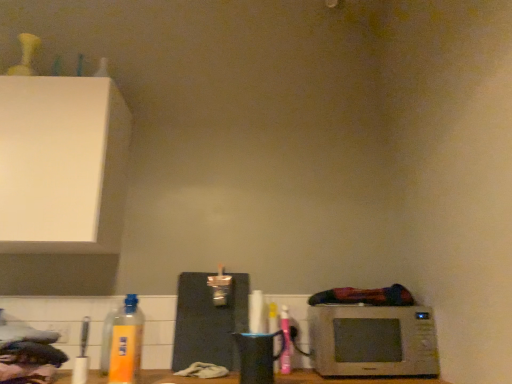
Image resolution: width=512 pixels, height=384 pixels. In order to click on yellow matte bottle at lower left, placed as the 2th bottle when sorted from back to front in this screenshot , I will do `click(108, 338)`.

Measure the distance between point (177, 341) and camera.

Point (177, 341) and camera are 5.88 feet apart from each other.

Image resolution: width=512 pixels, height=384 pixels. What are the coordinates of `yellow matte bottle at lower left, placed as the 2th bottle when sorted from right to left` in the screenshot? It's located at click(126, 343).

At what (x,y) coordinates should I click in order to perform the action: click on silver metallic microwave at lower right. Please return your answer as a coordinate pair (x, y). Looking at the image, I should click on (373, 341).

From the image's perspective, which one is positioned higher, yellow matte bottle at lower left, which appears as the 3th bottle when viewed from the right, or silver metallic microwave at lower right?

yellow matte bottle at lower left, which appears as the 3th bottle when viewed from the right, appears higher in the image.

Looking at this image, does yellow matte bottle at lower left, which appears as the 3th bottle when viewed from the right, have a lesser height compared to silver metallic microwave at lower right?

In fact, yellow matte bottle at lower left, which appears as the 3th bottle when viewed from the right, may be taller than silver metallic microwave at lower right.

In terms of width, does yellow matte bottle at lower left, placed as the 2th bottle when sorted from back to front, look wider or thinner when compared to silver metallic microwave at lower right?

In the image, yellow matte bottle at lower left, placed as the 2th bottle when sorted from back to front, appears to be more narrow than silver metallic microwave at lower right.

How far apart are yellow matte bottle at lower left, the first bottle from the left, and silver metallic microwave at lower right?

yellow matte bottle at lower left, the first bottle from the left, and silver metallic microwave at lower right are 39.33 inches apart from each other.

From the image's perspective, is pink matte spray can at lower right, marked as the 1th bottle in a right-to-left arrangement, over white plastic electric outlet at lower left?

Correct, pink matte spray can at lower right, marked as the 1th bottle in a right-to-left arrangement, appears higher than white plastic electric outlet at lower left in the image.

Identify the location of electric outlet located behind the pink matte spray can at lower right, marked as the 1th bottle in a right-to-left arrangement. This screenshot has width=512, height=384. (60, 331).

Between pink matte spray can at lower right, marked as the 1th bottle in a right-to-left arrangement, and white plastic electric outlet at lower left, which one has larger size?

Bigger between the two is pink matte spray can at lower right, marked as the 1th bottle in a right-to-left arrangement.

Does point (115, 358) lie in front of point (67, 331)?

Yes, point (115, 358) is closer to viewer.

From the image's perspective, would you say yellow matte bottle at lower left, which is the second bottle in left-to-right order, is shown under white plastic electric outlet at lower left?

No, from the image's perspective, yellow matte bottle at lower left, which is the second bottle in left-to-right order, is not below white plastic electric outlet at lower left.

From a real-world perspective, who is located higher, yellow matte bottle at lower left, which appears as the 3th bottle when viewed from the right, or yellow matte bottle at lower left, placed as the 2th bottle when sorted from right to left?

From a 3D spatial view, yellow matte bottle at lower left, placed as the 2th bottle when sorted from right to left, is above.

Can we say yellow matte bottle at lower left, acting as the second bottle starting from the front, lies outside yellow matte bottle at lower left, placed as the 2th bottle when sorted from right to left?

Yes, yellow matte bottle at lower left, acting as the second bottle starting from the front, is not within yellow matte bottle at lower left, placed as the 2th bottle when sorted from right to left.

From the picture: Considering the positions of objects yellow matte bottle at lower left, placed as the 2th bottle when sorted from back to front, and yellow matte bottle at lower left, which is the second bottle in left-to-right order, in the image provided, who is more to the left, yellow matte bottle at lower left, placed as the 2th bottle when sorted from back to front, or yellow matte bottle at lower left, which is the second bottle in left-to-right order,?

Positioned to the left is yellow matte bottle at lower left, placed as the 2th bottle when sorted from back to front.

From the picture: How different are the orientations of yellow matte bottle at lower left, acting as the second bottle starting from the front, and yellow matte bottle at lower left, marked as the 3th bottle in a back-to-front arrangement, in degrees?

The angular difference between yellow matte bottle at lower left, acting as the second bottle starting from the front, and yellow matte bottle at lower left, marked as the 3th bottle in a back-to-front arrangement, is 6.51 degrees.

Is pink matte spray can at lower right, positioned as the 3th bottle in front-to-back order, not inside silver metallic microwave at lower right?

pink matte spray can at lower right, positioned as the 3th bottle in front-to-back order, is positioned outside silver metallic microwave at lower right.

Is pink matte spray can at lower right, positioned as the 3th bottle in front-to-back order, turned away from silver metallic microwave at lower right?

No.

Looking at this image, is pink matte spray can at lower right, arranged as the 1th bottle when viewed from the back, at the left side of silver metallic microwave at lower right?

Yes, pink matte spray can at lower right, arranged as the 1th bottle when viewed from the back, is to the left of silver metallic microwave at lower right.

Consider the image. Considering the sizes of objects yellow matte bottle at lower left, acting as the second bottle starting from the front, and white plastic electric outlet at lower left in the image provided, who is smaller, yellow matte bottle at lower left, acting as the second bottle starting from the front, or white plastic electric outlet at lower left?

Smaller between the two is white plastic electric outlet at lower left.

Consider the image. Between yellow matte bottle at lower left, acting as the second bottle starting from the front, and white plastic electric outlet at lower left, which one has smaller width?

With smaller width is white plastic electric outlet at lower left.

Can you see yellow matte bottle at lower left, which appears as the 3th bottle when viewed from the right, touching white plastic electric outlet at lower left?

No, yellow matte bottle at lower left, which appears as the 3th bottle when viewed from the right, is not beside white plastic electric outlet at lower left.

Starting from the silver metallic microwave at lower right, which bottle is the 2nd one behind? Please provide its 2D coordinates.

[(285, 341)]

How distant is silver metallic microwave at lower right from pink matte spray can at lower right, marked as the 1th bottle in a right-to-left arrangement?

silver metallic microwave at lower right and pink matte spray can at lower right, marked as the 1th bottle in a right-to-left arrangement, are 32.06 centimeters apart.

From a real-world perspective, is silver metallic microwave at lower right positioned above or below pink matte spray can at lower right, marked as the 1th bottle in a right-to-left arrangement?

From a real-world perspective, silver metallic microwave at lower right is physically below pink matte spray can at lower right, marked as the 1th bottle in a right-to-left arrangement.

Is silver metallic microwave at lower right oriented towards pink matte spray can at lower right, arranged as the 1th bottle when viewed from the back?

No, silver metallic microwave at lower right does not turn towards pink matte spray can at lower right, arranged as the 1th bottle when viewed from the back.

I want to click on bottle that is the 3rd one when counting leftward from the silver metallic microwave at lower right, so click(108, 338).

This screenshot has width=512, height=384. Identify the location of the 1st bottle located above the white plastic electric outlet at lower left (from a real-world perspective). (285, 341).

Based on their spatial positions, is pink matte spray can at lower right, marked as the 1th bottle in a right-to-left arrangement, or yellow matte bottle at lower left, which is the 1th bottle in front-to-back order, closer to yellow matte bottle at lower left, placed as the 2th bottle when sorted from back to front?

yellow matte bottle at lower left, which is the 1th bottle in front-to-back order, is positioned closer to the anchor yellow matte bottle at lower left, placed as the 2th bottle when sorted from back to front.

Looking at this image, estimate the real-world distances between objects in this image. Which object is closer to white plastic electric outlet at lower left, pink matte spray can at lower right, arranged as the 1th bottle when viewed from the back, or yellow matte bottle at lower left, which is the second bottle in left-to-right order?

yellow matte bottle at lower left, which is the second bottle in left-to-right order, is closer to white plastic electric outlet at lower left.

Estimate the real-world distances between objects in this image. Which object is further from pink matte spray can at lower right, arranged as the 1th bottle when viewed from the back, silver metallic microwave at lower right or yellow matte bottle at lower left, marked as the 3th bottle in a back-to-front arrangement?

yellow matte bottle at lower left, marked as the 3th bottle in a back-to-front arrangement, is further to pink matte spray can at lower right, arranged as the 1th bottle when viewed from the back.

Estimate the real-world distances between objects in this image. Which object is further from silver metallic microwave at lower right, black matte cutting board at center or pink matte spray can at lower right, positioned as the 3th bottle in front-to-back order?

black matte cutting board at center is positioned further to the anchor silver metallic microwave at lower right.

Based on their spatial positions, is black matte cutting board at center or yellow matte bottle at lower left, the first bottle from the left, further from pink matte spray can at lower right, the 3th bottle positioned from the left?

yellow matte bottle at lower left, the first bottle from the left.

From the image, which object appears to be farther from pink matte spray can at lower right, positioned as the 3th bottle in front-to-back order, yellow matte bottle at lower left, placed as the 2th bottle when sorted from right to left, or white plastic electric outlet at lower left?

Among the two, white plastic electric outlet at lower left is located further to pink matte spray can at lower right, positioned as the 3th bottle in front-to-back order.

Consider the image. Based on their spatial positions, is black matte cutting board at center or white plastic electric outlet at lower left closer to yellow matte bottle at lower left, acting as the second bottle starting from the front?

Based on the image, white plastic electric outlet at lower left appears to be nearer to yellow matte bottle at lower left, acting as the second bottle starting from the front.

Estimate the real-world distances between objects in this image. Which object is further from black matte cutting board at center, yellow matte bottle at lower left, which is the 1th bottle in front-to-back order, or silver metallic microwave at lower right?

The object further to black matte cutting board at center is silver metallic microwave at lower right.

I want to click on bottle between yellow matte bottle at lower left, which appears as the 3th bottle when viewed from the right, and pink matte spray can at lower right, positioned as the 3th bottle in front-to-back order, so click(x=126, y=343).

You are a GUI agent. You are given a task and a screenshot of the screen. Output one action in this format:
    pyautogui.click(x=<x>, y=<y>)
    Task: Click on the appliance located between yellow matte bottle at lower left, which appears as the 3th bottle when viewed from the right, and silver metallic microwave at lower right in the left-right direction
    
    Given the screenshot: What is the action you would take?
    pyautogui.click(x=209, y=321)

Locate an element on the screen. The width and height of the screenshot is (512, 384). bottle situated between black matte cutting board at center and silver metallic microwave at lower right from left to right is located at coordinates (285, 341).

At what (x,y) coordinates should I click in order to perform the action: click on bottle between yellow matte bottle at lower left, marked as the 3th bottle in a back-to-front arrangement, and silver metallic microwave at lower right from left to right. Please return your answer as a coordinate pair (x, y). Looking at the image, I should click on (285, 341).